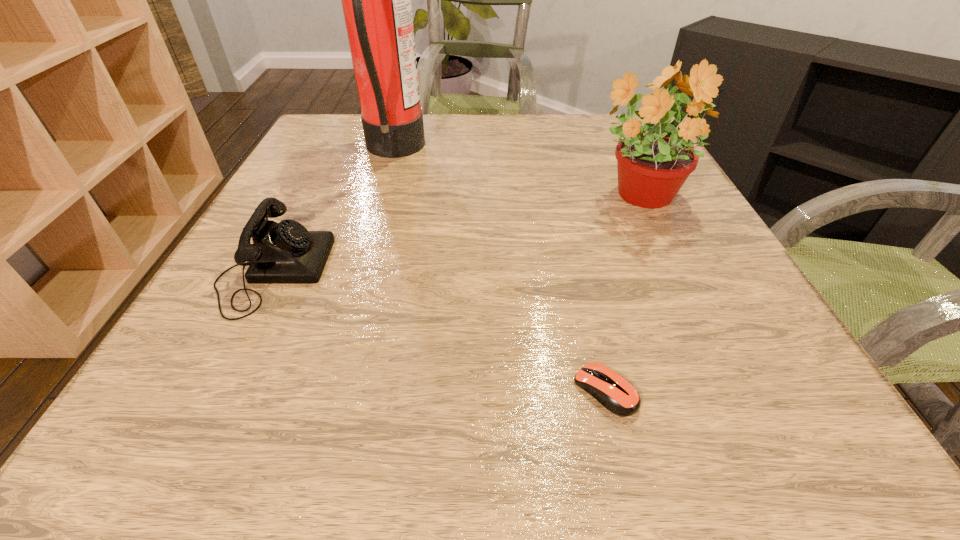
Locate an element on the screen. This screenshot has height=540, width=960. fire extinguisher is located at coordinates (376, 0).

I want to click on flowerpot, so click(652, 167).

Locate an element on the screen. the third shortest object is located at coordinates (652, 167).

Where is `telephone`? telephone is located at coordinates (286, 252).

Image resolution: width=960 pixels, height=540 pixels. I want to click on the second shortest object, so click(x=286, y=252).

Find the location of a particular element. Image resolution: width=960 pixels, height=540 pixels. computer mouse is located at coordinates (618, 395).

Identify the location of the nearest object. The image size is (960, 540). (x=618, y=395).

In order to click on vacant space located on the front-facing side of the fire extinguisher in this screenshot , I will do `click(467, 151)`.

Locate an element on the screen. This screenshot has width=960, height=540. vacant space located 0.370m on the left of the flowerpot is located at coordinates (405, 197).

What are the coordinates of `vacant space located on the front face of the second shortest object` in the screenshot? It's located at (372, 271).